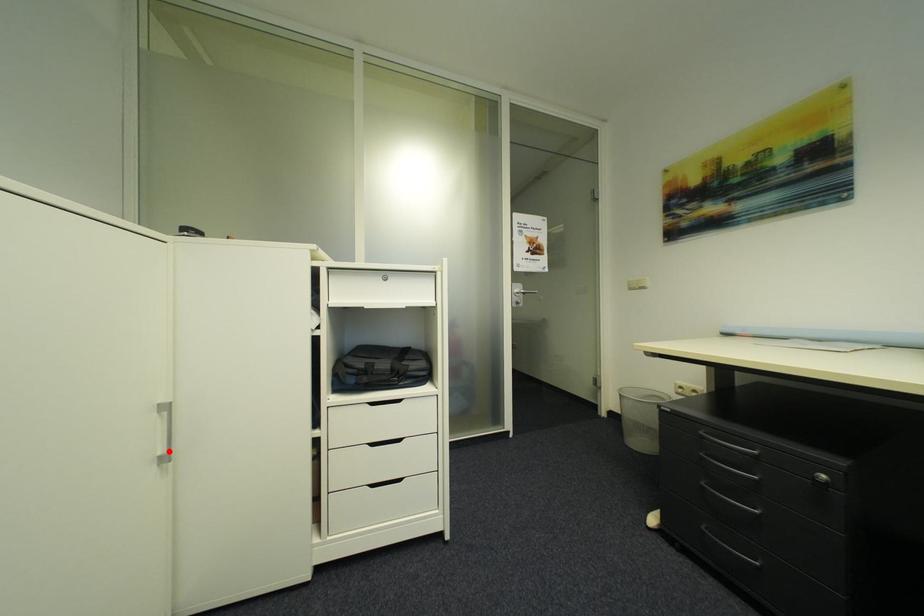
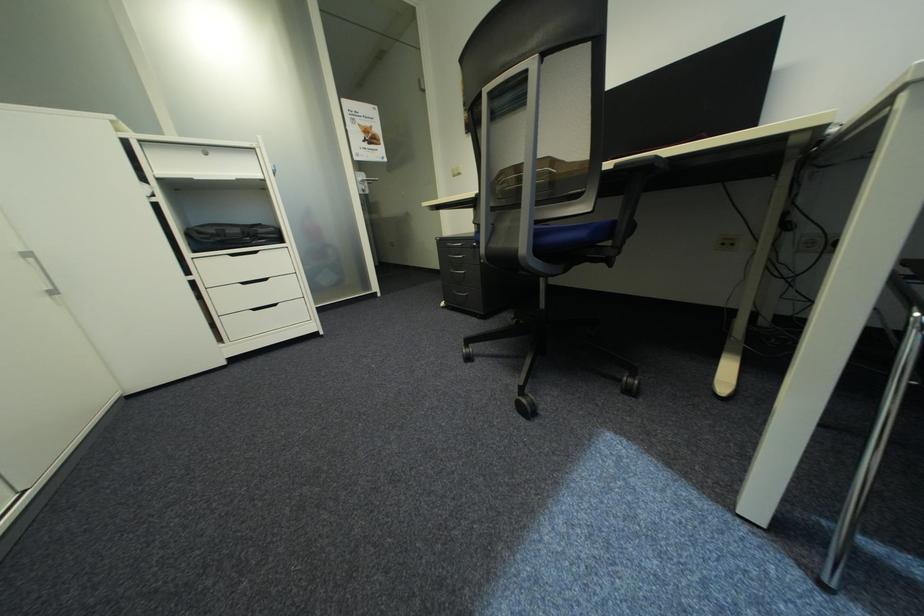
Question: I am providing you with two images of the same scene from different viewpoints. A red point is marked on the first image. Can you still see the location of the red point in image 2?

Choices:
 (A) Yes
 (B) No

Answer: (A)